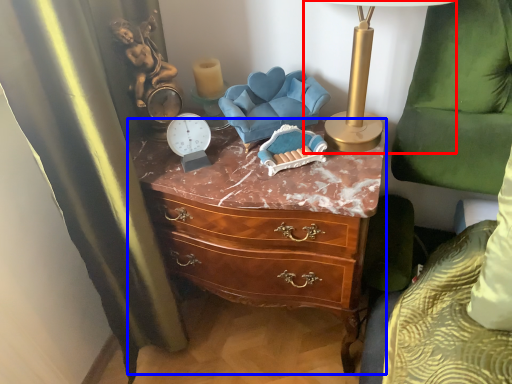
Question: Which of the following is the farthest to the observer, table lamp (highlighted by a red box) or chest of drawers (highlighted by a blue box)?

Choices:
 (A) table lamp
 (B) chest of drawers

Answer: (B)